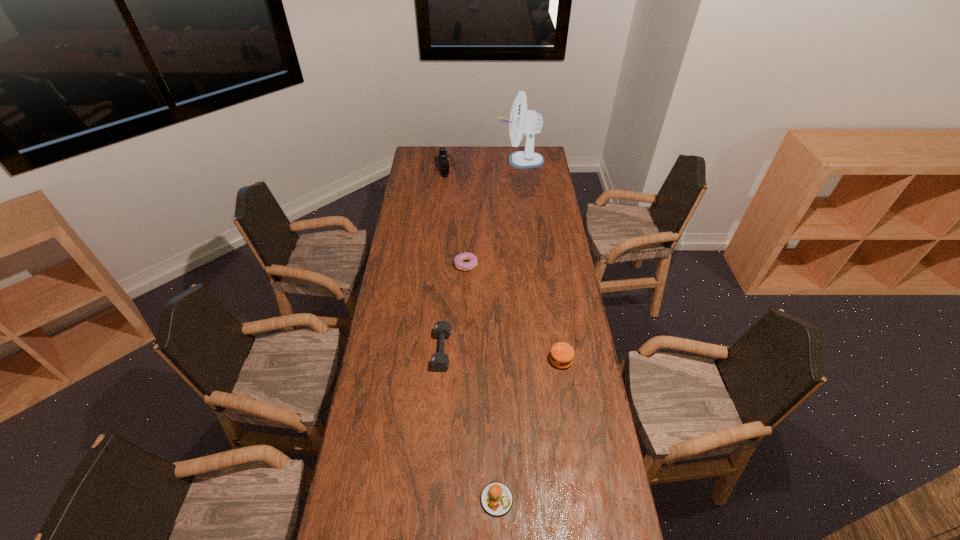
At what (x,y) coordinates should I click in order to perform the action: click on the tallest object. Please return your answer as a coordinate pair (x, y). Looking at the image, I should click on (522, 121).

I want to click on the fifth shortest object, so click(444, 162).

Identify the location of the farther patty. Image resolution: width=960 pixels, height=540 pixels. (562, 354).

I want to click on the taller patty, so click(562, 354).

Where is `dumbbell`? Image resolution: width=960 pixels, height=540 pixels. dumbbell is located at coordinates (442, 329).

The width and height of the screenshot is (960, 540). Identify the location of doughnut. (458, 260).

Where is `the nearest object`? the nearest object is located at coordinates (496, 498).

In order to click on the left patty in this screenshot , I will do `click(496, 498)`.

This screenshot has width=960, height=540. I want to click on free space located 0.200m on the grille of the fan, so click(462, 160).

Image resolution: width=960 pixels, height=540 pixels. I want to click on free region located 0.220m on the grille of the fan, so click(459, 160).